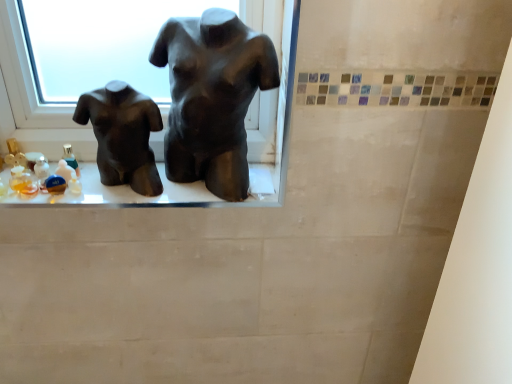
The height and width of the screenshot is (384, 512). Find the location of `free space above matte black mannequin torso at center (from a real-world perspective)`. free space above matte black mannequin torso at center (from a real-world perspective) is located at coordinates (106, 182).